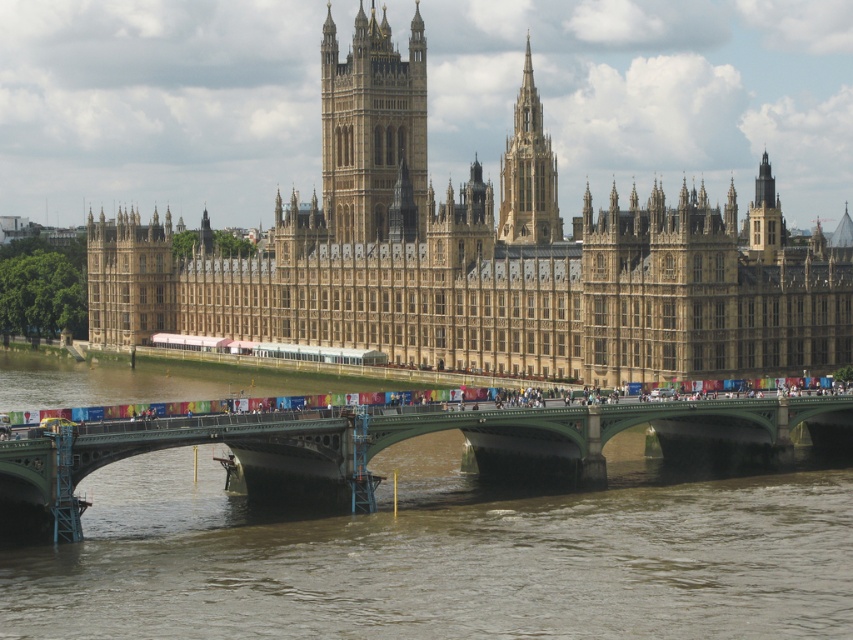
Which of these two, golden stone castle at upper center or green metallic bridge at lower center, stands shorter?

With less height is green metallic bridge at lower center.

Does point (819, 244) come closer to viewer compared to point (363, 484)?

No.

At what (x,y) coordinates should I click in order to perform the action: click on golden stone castle at upper center. Please return your answer as a coordinate pair (x, y). This screenshot has width=853, height=640. Looking at the image, I should click on (485, 257).

Is golden stone tower at center to the left of golden stone spire at upper center from the viewer's perspective?

Indeed, golden stone tower at center is positioned on the left side of golden stone spire at upper center.

Which is in front, point (386, 157) or point (529, 157)?

Point (529, 157) is in front.

This screenshot has width=853, height=640. I want to click on golden stone tower at center, so click(370, 125).

Does golden stone castle at upper center have a smaller size compared to golden stone spire at upper center?

Actually, golden stone castle at upper center might be larger than golden stone spire at upper center.

Who is positioned more to the right, golden stone castle at upper center or golden stone spire at upper center?

golden stone spire at upper center is more to the right.

Locate an element on the screen. Image resolution: width=853 pixels, height=640 pixels. golden stone castle at upper center is located at coordinates (485, 257).

Where is `golden stone castle at upper center`? This screenshot has width=853, height=640. golden stone castle at upper center is located at coordinates (485, 257).